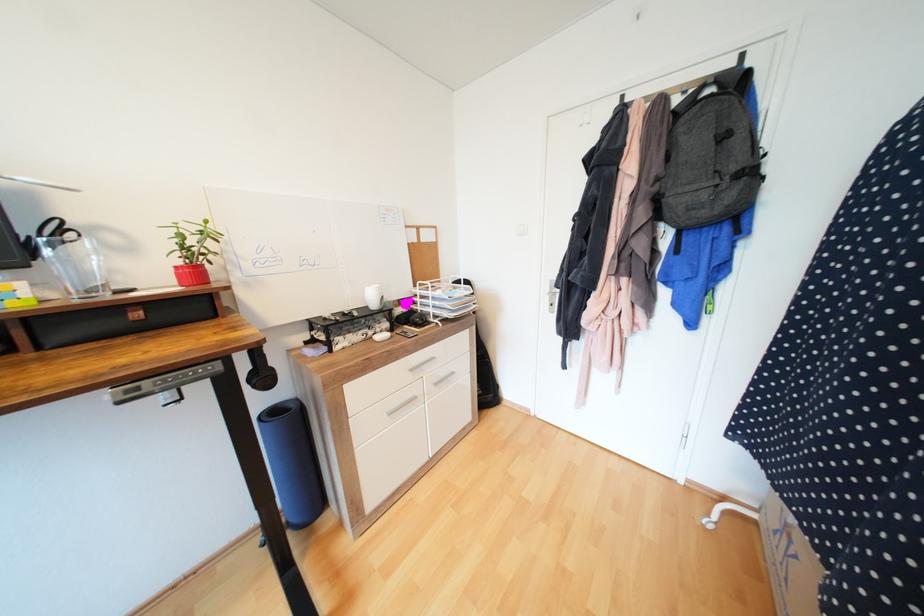
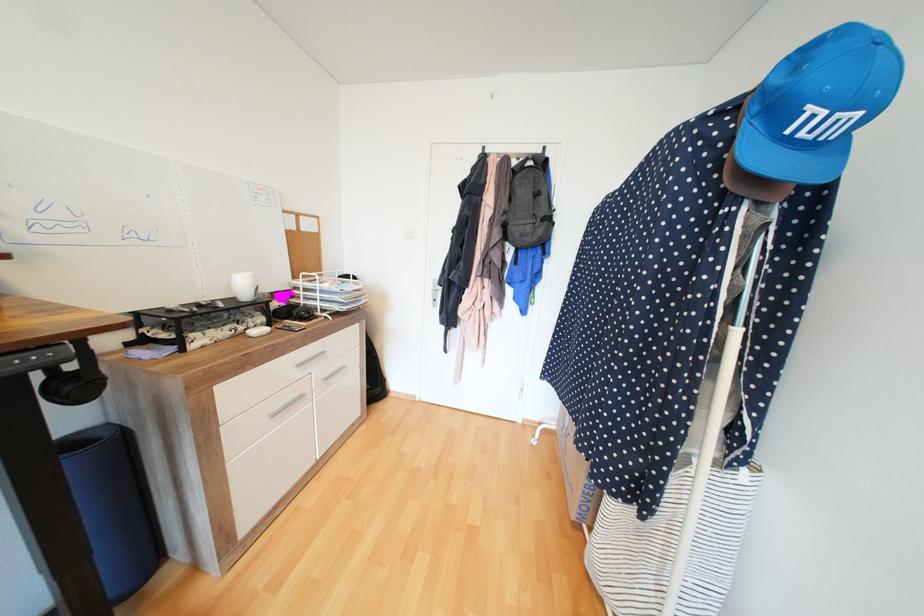
Find the pixel in the second image that matches point 663,180 in the first image.

(511, 213)